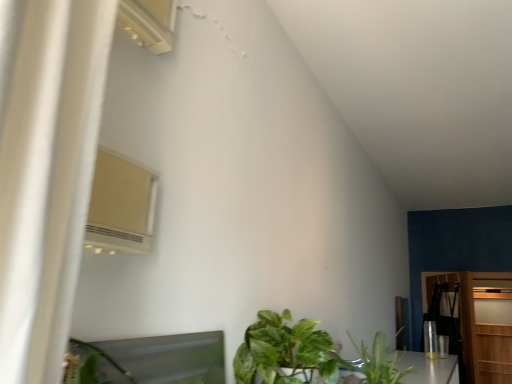
Question: Considering the relative positions of wooden dresser at right and white plastic air conditioner at upper left in the image provided, is wooden dresser at right to the left of white plastic air conditioner at upper left from the viewer's perspective?

Choices:
 (A) yes
 (B) no

Answer: (B)

Question: From the image's perspective, is wooden dresser at right located above white plastic air conditioner at upper left?

Choices:
 (A) no
 (B) yes

Answer: (A)

Question: Considering the relative sizes of wooden dresser at right and white plastic air conditioner at upper left in the image provided, is wooden dresser at right taller than white plastic air conditioner at upper left?

Choices:
 (A) no
 (B) yes

Answer: (B)

Question: Is wooden dresser at right bigger than white plastic air conditioner at upper left?

Choices:
 (A) yes
 (B) no

Answer: (A)

Question: Can you confirm if wooden dresser at right is wider than white plastic air conditioner at upper left?

Choices:
 (A) no
 (B) yes

Answer: (B)

Question: Is green leafy plant at lower center, acting as the second houseplant starting from the right, wider or thinner than green leafy plant at lower center, the 2th houseplant in the left-to-right sequence?

Choices:
 (A) wide
 (B) thin

Answer: (A)

Question: Would you say green leafy plant at lower center, marked as the 1th houseplant in a left-to-right arrangement, is inside or outside green leafy plant at lower center, arranged as the first houseplant when viewed from the right?

Choices:
 (A) inside
 (B) outside

Answer: (B)

Question: From a real-world perspective, is green leafy plant at lower center, acting as the second houseplant starting from the right, positioned above or below green leafy plant at lower center, the 2th houseplant in the left-to-right sequence?

Choices:
 (A) below
 (B) above

Answer: (B)

Question: In terms of size, does green leafy plant at lower center, acting as the second houseplant starting from the right, appear bigger or smaller than green leafy plant at lower center, arranged as the first houseplant when viewed from the right?

Choices:
 (A) big
 (B) small

Answer: (A)

Question: Choose the correct answer: Is wooden door at right inside wooden dresser at right or outside it?

Choices:
 (A) outside
 (B) inside

Answer: (A)

Question: From the image's perspective, is wooden door at right located above or below wooden dresser at right?

Choices:
 (A) above
 (B) below

Answer: (B)

Question: Considering the positions of point (472, 352) and point (453, 301), is point (472, 352) closer or farther from the camera than point (453, 301)?

Choices:
 (A) farther
 (B) closer

Answer: (B)

Question: Relative to wooden dresser at right, is wooden door at right in front or behind?

Choices:
 (A) behind
 (B) front

Answer: (A)

Question: From the image's perspective, is white plastic air conditioner at upper left positioned above or below green leafy plant at lower center, acting as the second houseplant starting from the right?

Choices:
 (A) above
 (B) below

Answer: (A)

Question: Based on their sizes in the image, would you say white plastic air conditioner at upper left is bigger or smaller than green leafy plant at lower center, acting as the second houseplant starting from the right?

Choices:
 (A) small
 (B) big

Answer: (A)